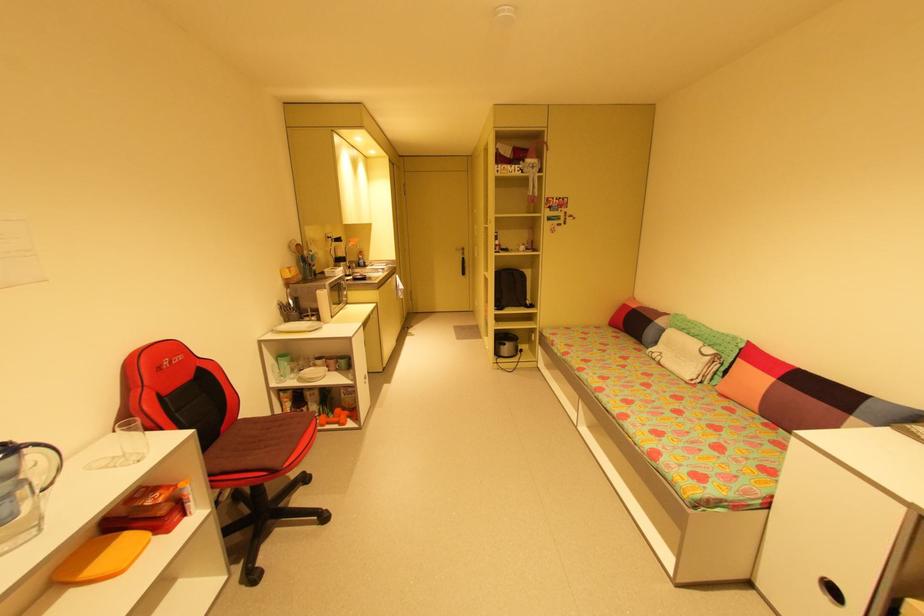
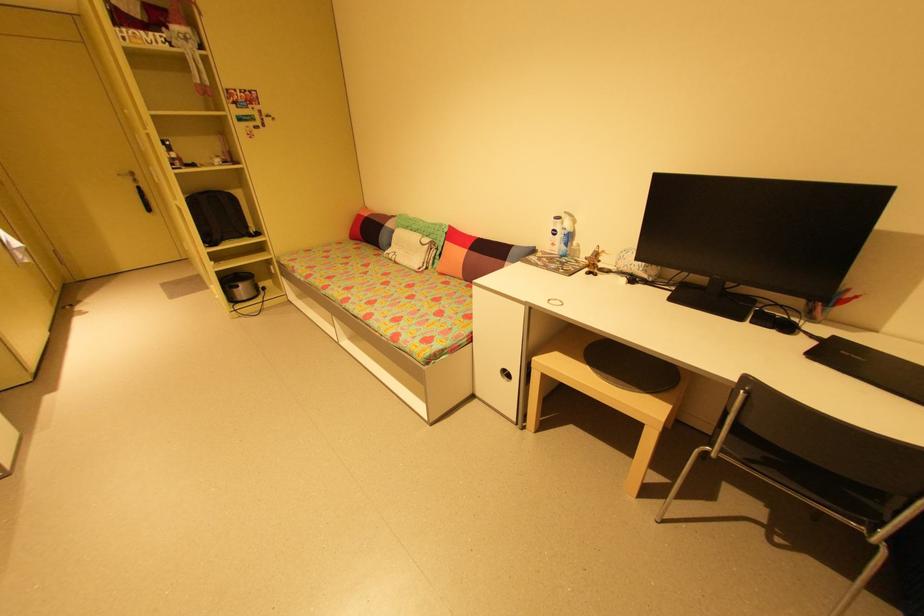
Find the pixel in the second image that matches the point at 505,347 in the first image.

(239, 291)